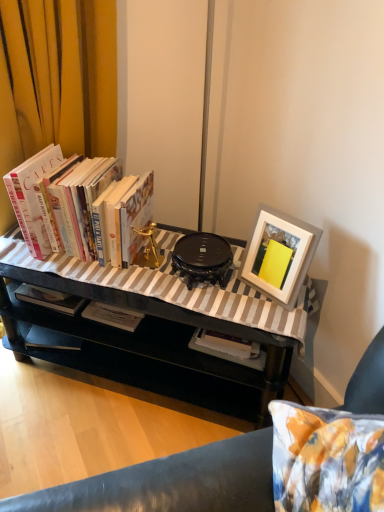
Where is `blank space above black glossy table at center (from a real-world perspective)`? blank space above black glossy table at center (from a real-world perspective) is located at coordinates (144, 280).